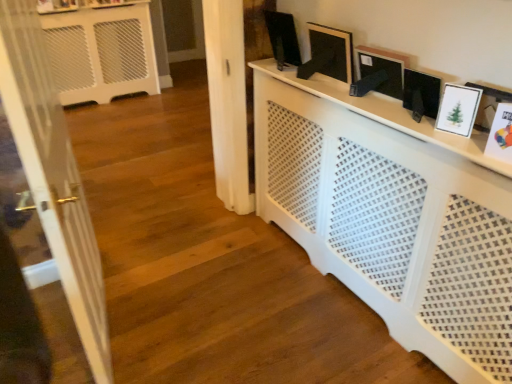
This screenshot has height=384, width=512. I want to click on vacant space underneath white glossy door at left (from a real-world perspective), so click(114, 323).